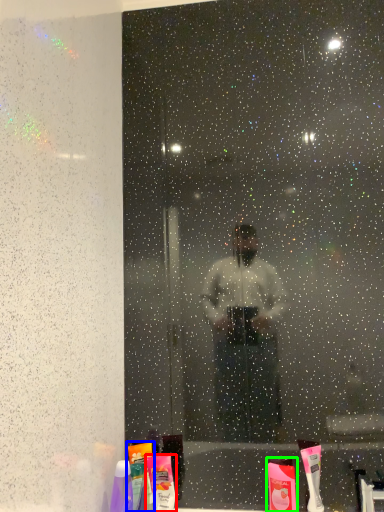
Question: Based on their relative distances, which object is farther from toiletry (highlighted by a red box)? Choose from mouthwash (highlighted by a blue box) and toiletry (highlighted by a green box).

Choices:
 (A) mouthwash
 (B) toiletry

Answer: (B)